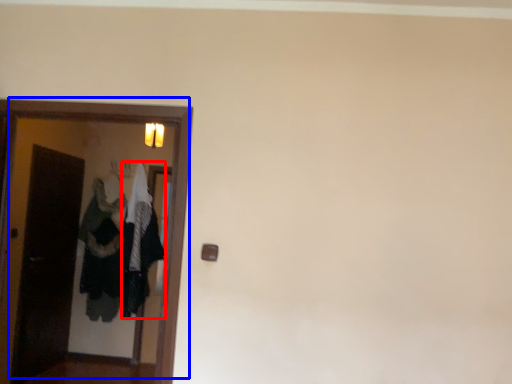
Question: Among these objects, which one is nearest to the camera, clothing (highlighted by a red box) or door (highlighted by a blue box)?

Choices:
 (A) clothing
 (B) door

Answer: (B)